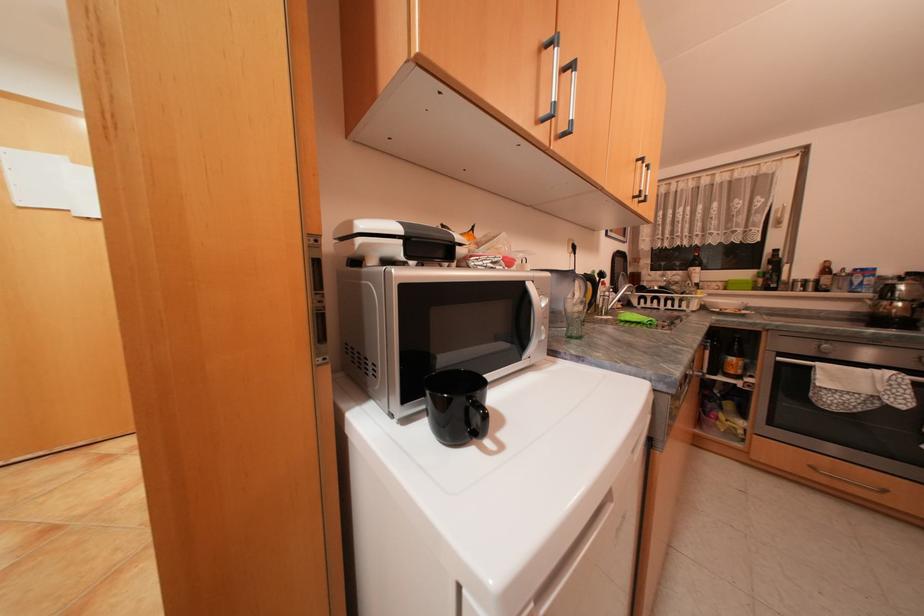
The height and width of the screenshot is (616, 924). What do you see at coordinates (592, 285) in the screenshot?
I see `the kettle handle` at bounding box center [592, 285].